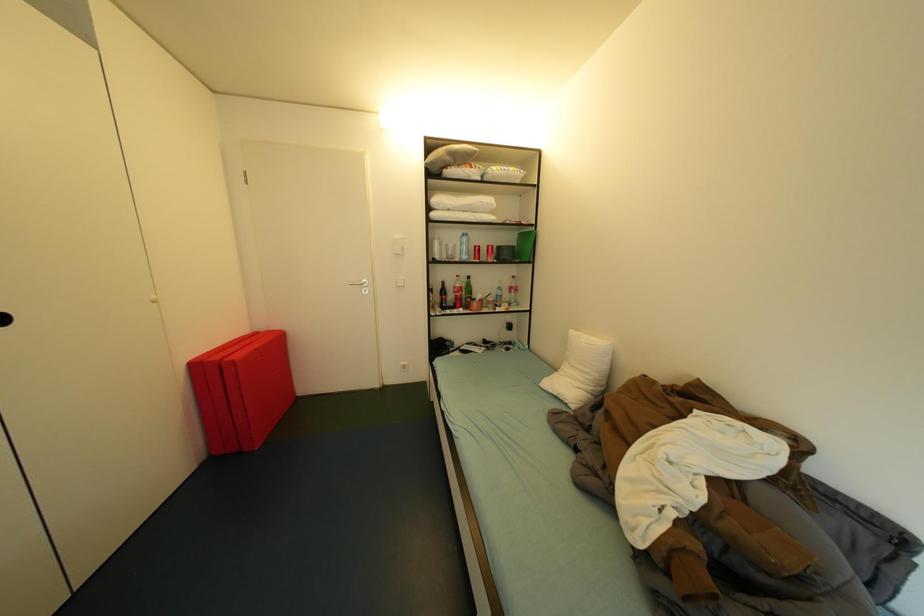
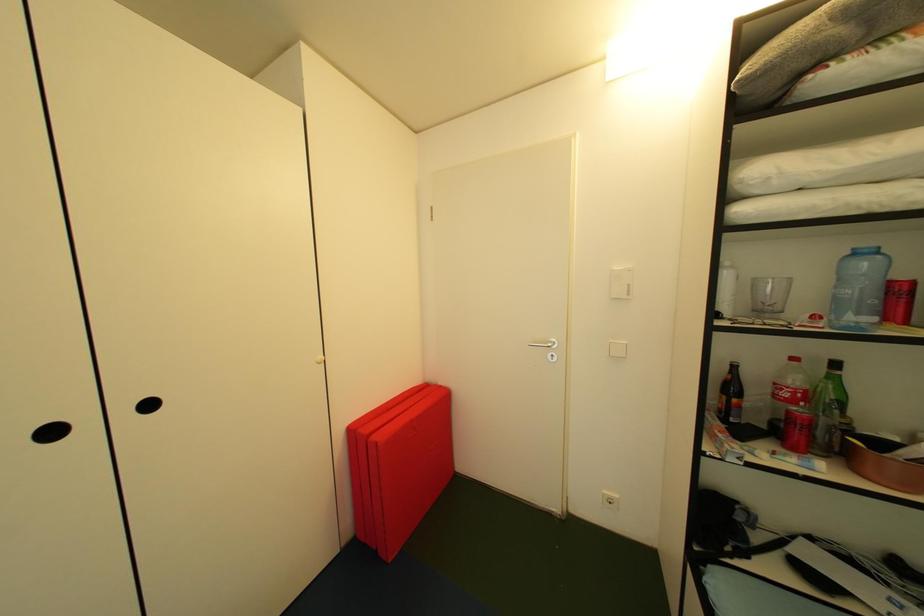
Question: Based on the continuous images, in which direction is the camera rotating? Reply with the corresponding letter.

Choices:
 (A) Left
 (B) Right
 (C) Up
 (D) Down

Answer: (A)